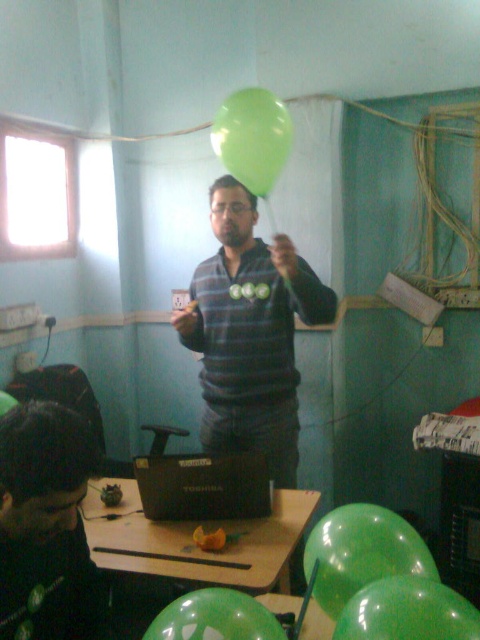
Does matte green sweater at center have a greater width compared to matte black laptop at lower left?

Indeed, matte green sweater at center has a greater width compared to matte black laptop at lower left.

Is matte green sweater at center behind matte black laptop at lower left?

Yes, matte green sweater at center is behind matte black laptop at lower left.

Is point (230, 304) positioned after point (67, 506)?

Yes, it is.

Identify the location of matte green sweater at center. [x=250, y=333].

Based on the photo, can you confirm if matte black laptop at lower left is positioned above green rubber balloon at center?

Yes, matte black laptop at lower left is above green rubber balloon at center.

Is point (46, 442) more distant than point (336, 563)?

No, (46, 442) is closer to viewer.

Image resolution: width=480 pixels, height=640 pixels. Find the location of `matte black laptop at lower left`. matte black laptop at lower left is located at coordinates (45, 524).

Between green rubber balloon at upper center and green matte balloon at center, which one appears on the right side from the viewer's perspective?

From the viewer's perspective, green matte balloon at center appears more on the right side.

Does point (255, 122) come behind point (249, 598)?

Yes, it is.

What do you see at coordinates (252, 138) in the screenshot? I see `green rubber balloon at upper center` at bounding box center [252, 138].

Find the location of a particular element. The width and height of the screenshot is (480, 640). green rubber balloon at upper center is located at coordinates (252, 138).